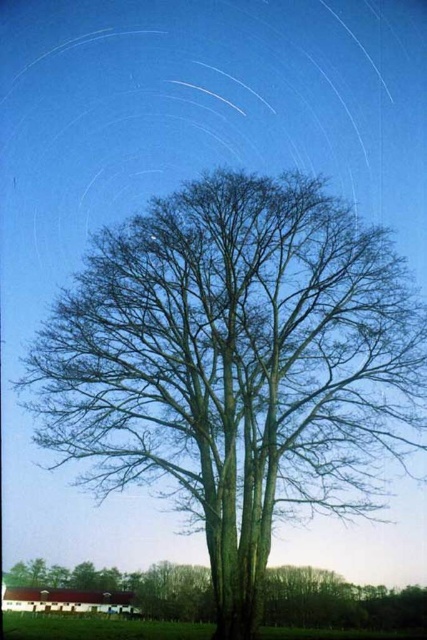
Question: Among these points, which one is nearest to the camera?

Choices:
 (A) (383, 616)
 (B) (84, 406)

Answer: (B)

Question: Does brown textured tree at center appear on the right side of green matte tree at center?

Choices:
 (A) yes
 (B) no

Answer: (A)

Question: Which of the following is the farthest from the observer?

Choices:
 (A) (35, 577)
 (B) (108, 305)

Answer: (A)

Question: Can you confirm if brown textured tree at center is positioned above green matte tree at center?

Choices:
 (A) no
 (B) yes

Answer: (B)

Question: In this image, where is brown textured tree at center located relative to green matte tree at center?

Choices:
 (A) below
 (B) above

Answer: (B)